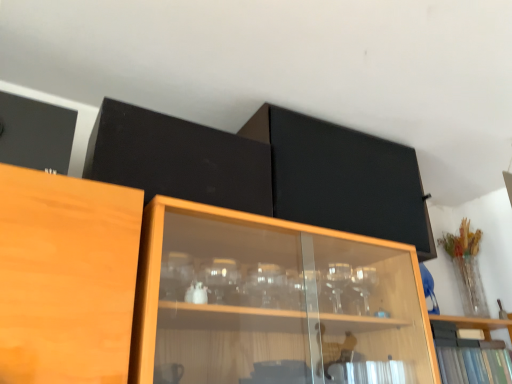
Locate an element on the screen. matte black cabinet at upper center is located at coordinates (343, 178).

The width and height of the screenshot is (512, 384). What do you see at coordinates (343, 178) in the screenshot?
I see `matte black cabinet at upper center` at bounding box center [343, 178].

This screenshot has width=512, height=384. Identify the location of matte black cabinet at upper center. (343, 178).